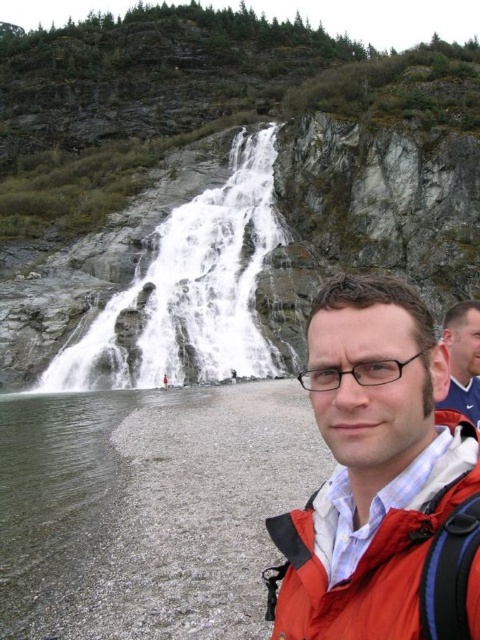
Is matte orange jacket at lower right positioned behind white textured water at upper center?

No.

Does matte orange jacket at lower right have a greater width compared to white textured water at upper center?

Incorrect, matte orange jacket at lower right's width does not surpass white textured water at upper center's.

Is point (431, 499) more distant than point (147, 332)?

No.

The height and width of the screenshot is (640, 480). I want to click on matte orange jacket at lower right, so click(x=377, y=476).

Identify the location of matte orange jacket at lower right. (377, 476).

Describe the element at coordinates (377, 476) in the screenshot. I see `matte orange jacket at lower right` at that location.

At what (x,y) coordinates should I click in order to perform the action: click on matte orange jacket at lower right. Please return your answer as a coordinate pair (x, y). The height and width of the screenshot is (640, 480). Looking at the image, I should click on pos(377,476).

Is white textured water at upper center below matte black glasses at center?

No.

Identify the location of white textured water at upper center. (191, 291).

Does point (206, 256) come in front of point (447, 328)?

No, (206, 256) is further to viewer.

At what (x,y) coordinates should I click in order to perform the action: click on white textured water at upper center. Please return your answer as a coordinate pair (x, y). Looking at the image, I should click on (191, 291).